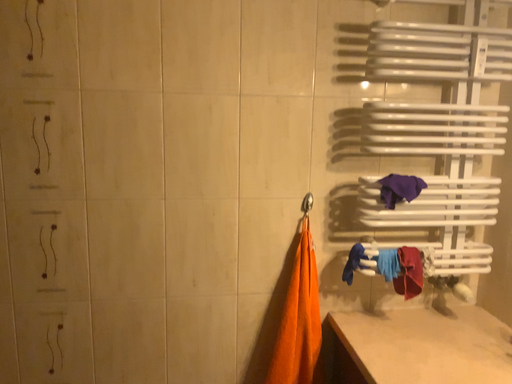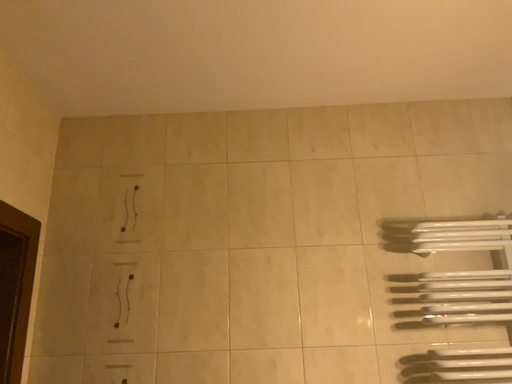
Question: Which way did the camera rotate in the video?

Choices:
 (A) rotated right
 (B) rotated left

Answer: (B)